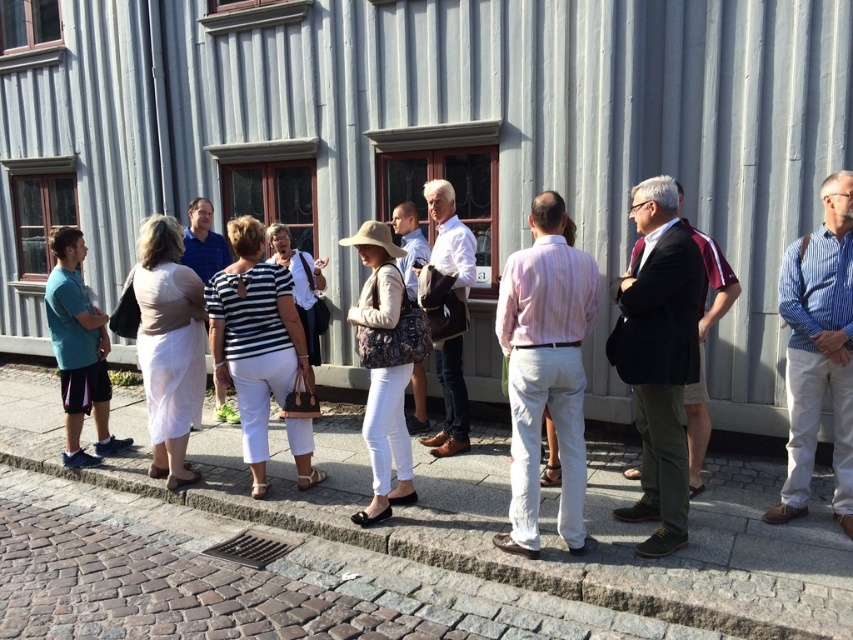
Can you confirm if pink striped shirt at center is thinner than patterned fabric hat at center?

No, pink striped shirt at center is not thinner than patterned fabric hat at center.

Does pink striped shirt at center have a greater width compared to patterned fabric hat at center?

Yes, pink striped shirt at center is wider than patterned fabric hat at center.

Where is `pink striped shirt at center`? pink striped shirt at center is located at coordinates (544, 371).

Between blue striped shirt at right and striped cotton shirt at center, which one appears on the left side from the viewer's perspective?

striped cotton shirt at center

Is blue striped shirt at right taller than striped cotton shirt at center?

Correct, blue striped shirt at right is much taller as striped cotton shirt at center.

Is point (850, 227) positioned after point (274, 372)?

That is False.

Locate an element on the screen. This screenshot has width=853, height=640. blue striped shirt at right is located at coordinates (817, 352).

Is point (498, 538) less distant than point (53, 316)?

Yes, it is in front of point (53, 316).

Which is below, pink striped shirt at center or teal fabric shorts at left?

Positioned lower is pink striped shirt at center.

Locate an element on the screen. The height and width of the screenshot is (640, 853). pink striped shirt at center is located at coordinates (544, 371).